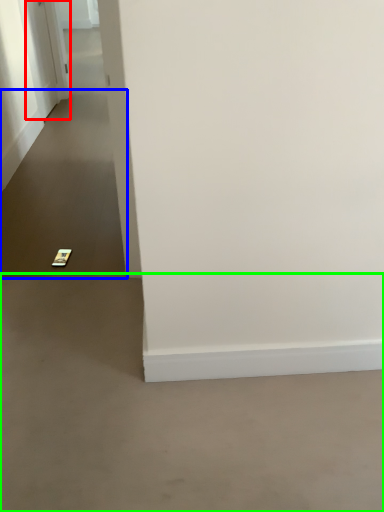
Question: Considering the real-world distances, which object is closest to door (highlighted by a red box)? path (highlighted by a blue box) or concrete (highlighted by a green box).

Choices:
 (A) path
 (B) concrete

Answer: (A)